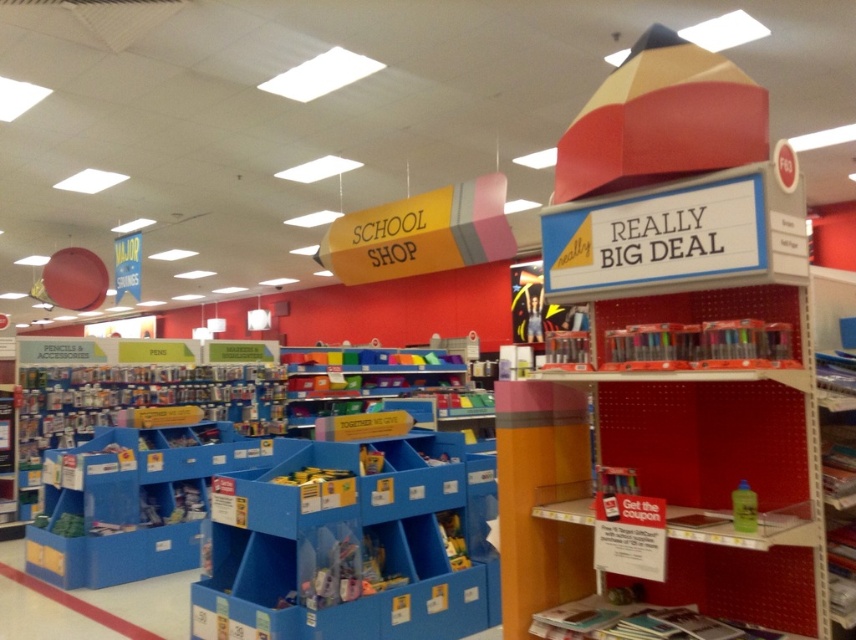
Is point (670, 532) farther from camera compared to point (384, 612)?

No, (670, 532) is closer to viewer.

Who is shorter, translucent plastic markers at upper right or blue plastic bins at lower left?

With less height is blue plastic bins at lower left.

Who is more distant from viewer, (756, 577) or (400, 483)?

Point (400, 483)

You are a GUI agent. You are given a task and a screenshot of the screen. Output one action in this format:
    pyautogui.click(x=<x>, y=<y>)
    Task: Click on the translucent plastic markers at upper right
    Image resolution: width=856 pixels, height=640 pixels.
    Given the screenshot: What is the action you would take?
    pyautogui.click(x=669, y=470)

Locate an element on the screen. Image resolution: width=856 pixels, height=640 pixels. blue plastic bins at lower left is located at coordinates (346, 547).

Between point (239, 563) and point (742, 483), which one is positioned in front?

Positioned in front is point (742, 483).

This screenshot has height=640, width=856. Find the location of `blue plastic bins at lower left`. blue plastic bins at lower left is located at coordinates (346, 547).

Between translucent plastic markers at upper right and translucent yellow bottle at center right, which one has less height?

translucent yellow bottle at center right is shorter.

Between point (657, 310) and point (741, 506), which one is positioned behind?

The point (657, 310) is behind.

The width and height of the screenshot is (856, 640). What do you see at coordinates (669, 470) in the screenshot? I see `translucent plastic markers at upper right` at bounding box center [669, 470].

This screenshot has height=640, width=856. Find the location of `translucent plastic markers at upper right`. translucent plastic markers at upper right is located at coordinates (669, 470).